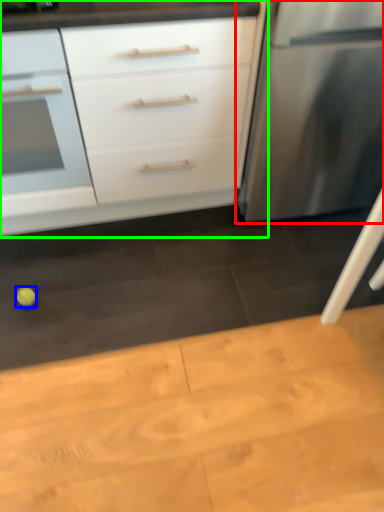
Question: Estimate the real-world distances between objects in this image. Which object is farther from refrigerator (highlighted by a red box), lime (highlighted by a blue box) or chest of drawers (highlighted by a green box)?

Choices:
 (A) lime
 (B) chest of drawers

Answer: (A)